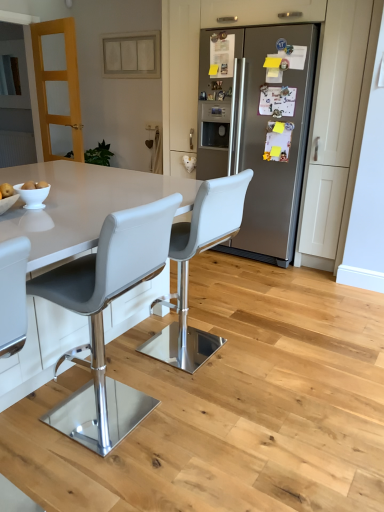
Question: Does white leather stool at center, which is the 2th chair in front-to-back order, have a larger size compared to white glossy bowl at lower left?

Choices:
 (A) yes
 (B) no

Answer: (A)

Question: Is the position of white leather stool at center, which is the 2th chair in front-to-back order, more distant than that of white glossy bowl at lower left?

Choices:
 (A) no
 (B) yes

Answer: (B)

Question: Is white leather stool at center, which is the 2th chair in front-to-back order, in front of white glossy bowl at lower left?

Choices:
 (A) no
 (B) yes

Answer: (A)

Question: Considering the relative sizes of white leather stool at center, which is the 2th chair in front-to-back order, and white glossy bowl at lower left in the image provided, is white leather stool at center, which is the 2th chair in front-to-back order, thinner than white glossy bowl at lower left?

Choices:
 (A) yes
 (B) no

Answer: (B)

Question: Does white leather stool at center, which is the 2th chair in front-to-back order, have a greater height compared to white glossy bowl at lower left?

Choices:
 (A) yes
 (B) no

Answer: (A)

Question: Considering the positions of yellow matte apple at lower left and beige matte cabinet at upper center in the image, is yellow matte apple at lower left taller or shorter than beige matte cabinet at upper center?

Choices:
 (A) short
 (B) tall

Answer: (A)

Question: From the image's perspective, is yellow matte apple at lower left above or below beige matte cabinet at upper center?

Choices:
 (A) above
 (B) below

Answer: (B)

Question: Relative to beige matte cabinet at upper center, is yellow matte apple at lower left in front or behind?

Choices:
 (A) behind
 (B) front

Answer: (B)

Question: Considering the positions of yellow matte apple at lower left and beige matte cabinet at upper center in the image, is yellow matte apple at lower left bigger or smaller than beige matte cabinet at upper center?

Choices:
 (A) small
 (B) big

Answer: (A)

Question: From their relative heights in the image, would you say satin silver refrigerator at center is taller or shorter than white glossy bowl at lower left?

Choices:
 (A) tall
 (B) short

Answer: (A)

Question: Based on their positions, is satin silver refrigerator at center located to the left or right of white glossy bowl at lower left?

Choices:
 (A) right
 (B) left

Answer: (A)

Question: Looking at the image, does satin silver refrigerator at center seem bigger or smaller compared to white glossy bowl at lower left?

Choices:
 (A) small
 (B) big

Answer: (B)

Question: From a real-world perspective, is satin silver refrigerator at center physically located above or below white glossy bowl at lower left?

Choices:
 (A) below
 (B) above

Answer: (A)

Question: Considering the positions of point (135, 56) and point (196, 214), is point (135, 56) closer or farther from the camera than point (196, 214)?

Choices:
 (A) farther
 (B) closer

Answer: (A)

Question: Based on their sizes in the image, would you say beige matte cabinet at upper center is bigger or smaller than white leather stool at center, which appears as the 1th chair when viewed from the back?

Choices:
 (A) big
 (B) small

Answer: (B)